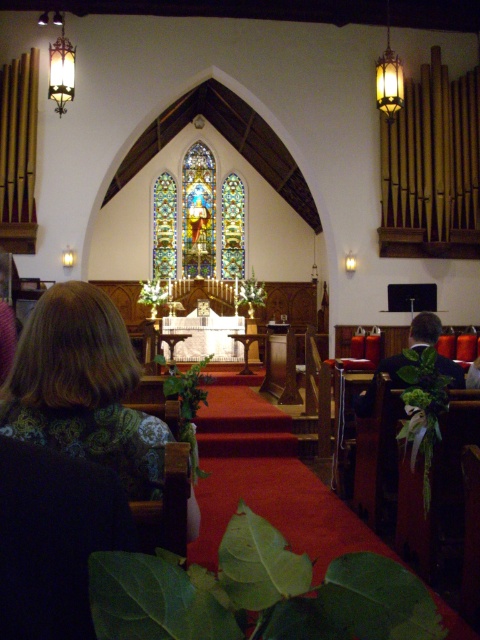
Does brown textured hair at lower left appear under stained glass at center?

Yes.

Does brown textured hair at lower left have a lesser width compared to stained glass at center?

Incorrect, brown textured hair at lower left's width is not less than stained glass at center's.

Does point (170, 440) come closer to viewer compared to point (243, 237)?

Yes.

This screenshot has height=640, width=480. Find the location of `brown textured hair at lower left`. brown textured hair at lower left is located at coordinates (84, 388).